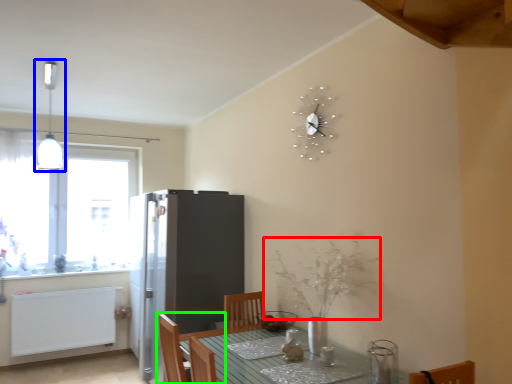
Question: Which object is the closest to the flower (highlighted by a red box)? Choose among these: light fixture (highlighted by a blue box) or chair (highlighted by a green box).

Choices:
 (A) light fixture
 (B) chair

Answer: (B)